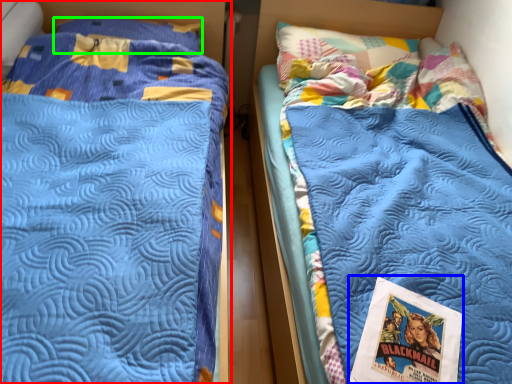
Question: Estimate the real-world distances between objects in this image. Which object is farther from bed (highlighted by a red box), comic book (highlighted by a blue box) or pillow (highlighted by a green box)?

Choices:
 (A) comic book
 (B) pillow

Answer: (A)